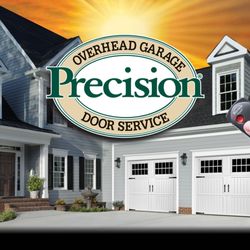
The image size is (250, 250). In order to click on windows in this screenshot , I will do `click(56, 175)`, `click(86, 171)`, `click(57, 121)`, `click(225, 95)`.